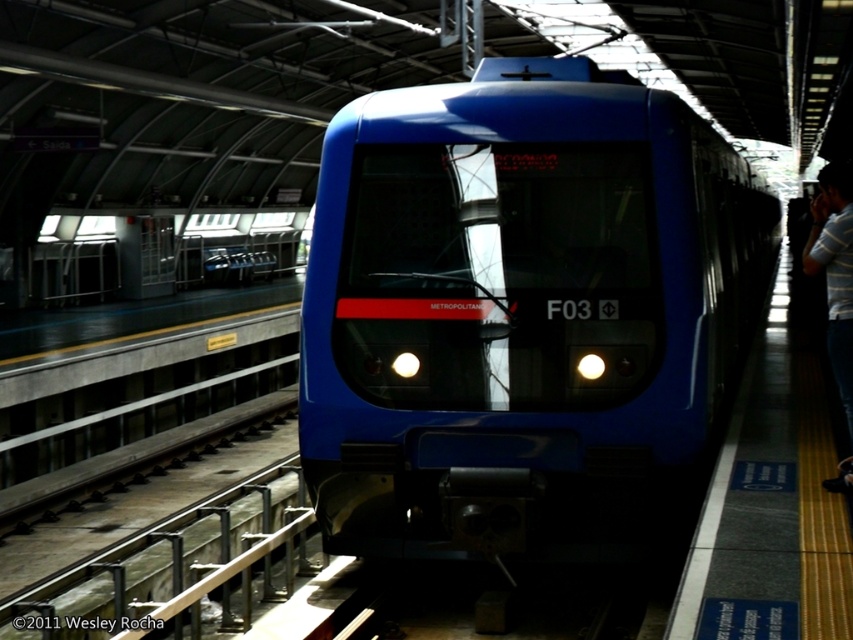
You are a passenger waiting at the subway station. You see the blue glossy train at center and the striped cotton shirt at right. Which object is closer to the platform edge marked by yellow tactile paving?

The blue glossy train at center is positioned on the left side of striped cotton shirt at right, so it is closer to the platform edge marked by yellow tactile paving.

You are a passenger waiting on the platform and see the blue glossy train at center and the striped cotton shirt at right. Which object takes up more space in the image?

The striped cotton shirt at right occupies more space than the blue glossy train at center.